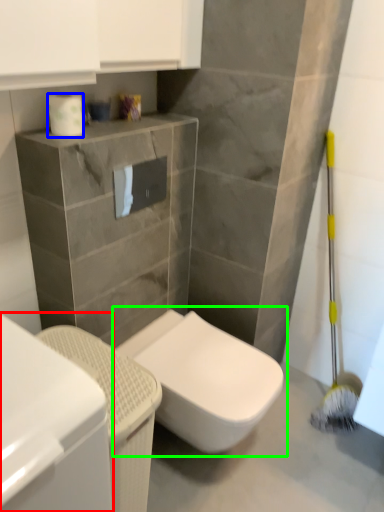
Question: Considering the real-world distances, which object is farthest from cabinetry (highlighted by a red box)? toilet paper (highlighted by a blue box) or toilet (highlighted by a green box)?

Choices:
 (A) toilet paper
 (B) toilet

Answer: (A)